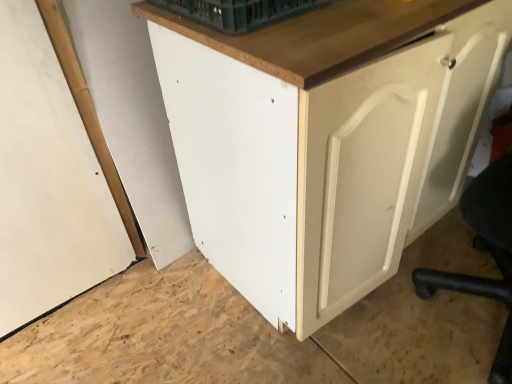
What do you see at coordinates (239, 12) in the screenshot?
I see `green plastic basket at upper center` at bounding box center [239, 12].

Locate an element on the screen. Image resolution: width=512 pixels, height=384 pixels. white matte door at right is located at coordinates (457, 126).

Where is `matte white cabinet at center`? Image resolution: width=512 pixels, height=384 pixels. matte white cabinet at center is located at coordinates (325, 140).

Considering the relative sizes of matte white cabinet at center and white matte door at right in the image provided, is matte white cabinet at center shorter than white matte door at right?

In fact, matte white cabinet at center may be taller than white matte door at right.

Consider the image. Does matte white cabinet at center have a greater width compared to white matte door at right?

Correct, the width of matte white cabinet at center exceeds that of white matte door at right.

The width and height of the screenshot is (512, 384). Find the location of `door lying on the right of matte white cabinet at center`. door lying on the right of matte white cabinet at center is located at coordinates (457, 126).

Who is smaller, matte white cabinet at center or white matte door at right?

white matte door at right.

Considering the relative sizes of green plastic basket at upper center and white matte door at right in the image provided, is green plastic basket at upper center wider than white matte door at right?

No, green plastic basket at upper center is not wider than white matte door at right.

Where is `basket above the white matte door at right (from the image's perspective)`? This screenshot has width=512, height=384. basket above the white matte door at right (from the image's perspective) is located at coordinates (239, 12).

From the image's perspective, is green plastic basket at upper center located above or below white matte door at right?

green plastic basket at upper center is above white matte door at right.

Considering the sizes of objects white matte door at right and matte white cabinet at center in the image provided, who is shorter, white matte door at right or matte white cabinet at center?

white matte door at right is shorter.

Consider the image. Between white matte door at right and matte white cabinet at center, which one has larger size?

matte white cabinet at center.

Could you tell me if white matte door at right is turned towards matte white cabinet at center?

No, white matte door at right is not turned towards matte white cabinet at center.

The image size is (512, 384). What are the coordinates of `cabinetry below the white matte door at right (from the image's perspective)` in the screenshot? It's located at (325, 140).

How different are the orientations of white matte door at right and green plastic basket at upper center in degrees?

There is a 86.3-degree angle between the facing directions of white matte door at right and green plastic basket at upper center.

Is white matte door at right taller than green plastic basket at upper center?

Indeed, white matte door at right has a greater height compared to green plastic basket at upper center.

Based on the photo, from the image's perspective, which one is positioned higher, white matte door at right or green plastic basket at upper center?

green plastic basket at upper center is shown above in the image.

Where is `door lying on the right of green plastic basket at upper center`? door lying on the right of green plastic basket at upper center is located at coordinates (457, 126).

Does green plastic basket at upper center have a larger size compared to matte white cabinet at center?

Actually, green plastic basket at upper center might be smaller than matte white cabinet at center.

Could you tell me if green plastic basket at upper center is facing matte white cabinet at center?

No.

Can you confirm if green plastic basket at upper center is thinner than matte white cabinet at center?

Correct, the width of green plastic basket at upper center is less than that of matte white cabinet at center.

Considering the positions of points (192, 13) and (273, 69), is point (192, 13) closer to camera compared to point (273, 69)?

That is False.

Looking at this image, can you see matte white cabinet at center touching green plastic basket at upper center?

No, matte white cabinet at center is not making contact with green plastic basket at upper center.

Is matte white cabinet at center spatially inside green plastic basket at upper center, or outside of it?

matte white cabinet at center lies outside green plastic basket at upper center.

Is matte white cabinet at center oriented away from green plastic basket at upper center?

matte white cabinet at center does not have its back to green plastic basket at upper center.

Can you tell me how much matte white cabinet at center and green plastic basket at upper center differ in facing direction?

The angle between the facing direction of matte white cabinet at center and the facing direction of green plastic basket at upper center is 0.571 degrees.

Where is `door above the matte white cabinet at center (from the image's perspective)`? Image resolution: width=512 pixels, height=384 pixels. door above the matte white cabinet at center (from the image's perspective) is located at coordinates (457, 126).

The height and width of the screenshot is (384, 512). I want to click on basket above the white matte door at right (from a real-world perspective), so click(239, 12).

From the image, which object appears to be nearer to white matte door at right, matte white cabinet at center or green plastic basket at upper center?

Among the two, matte white cabinet at center is located nearer to white matte door at right.

When comparing their distances from matte white cabinet at center, does white matte door at right or green plastic basket at upper center seem closer?

Based on the image, white matte door at right appears to be nearer to matte white cabinet at center.

Based on the photo, which object lies further to the anchor point white matte door at right, green plastic basket at upper center or matte white cabinet at center?

Among the two, green plastic basket at upper center is located further to white matte door at right.

Which object lies nearer to the anchor point matte white cabinet at center, green plastic basket at upper center or white matte door at right?

white matte door at right.

Which object lies nearer to the anchor point green plastic basket at upper center, matte white cabinet at center or white matte door at right?

matte white cabinet at center lies closer to green plastic basket at upper center than the other object.

Looking at the image, which one is located further to green plastic basket at upper center, white matte door at right or matte white cabinet at center?

Among the two, white matte door at right is located further to green plastic basket at upper center.

Find the location of `cabinetry between green plastic basket at upper center and white matte door at right from left to right`. cabinetry between green plastic basket at upper center and white matte door at right from left to right is located at coordinates (325, 140).